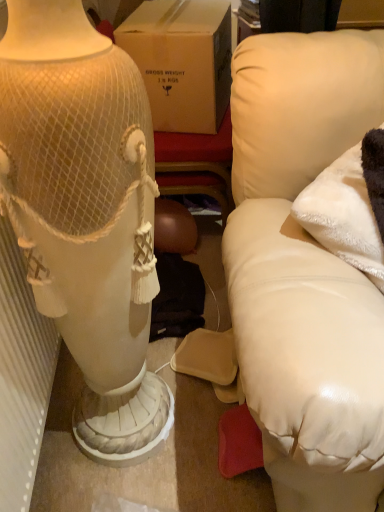
Find the location of a particular element. Image resolution: width=384 pixels, height=512 pixels. white fluffy pillow at right is located at coordinates (350, 207).

From a real-world perspective, is white fluffy pillow at right located beneath white textured radiator at left?

Actually, white fluffy pillow at right is physically above white textured radiator at left in the real world.

Considering the relative sizes of white fluffy pillow at right and white textured radiator at left in the image provided, is white fluffy pillow at right taller than white textured radiator at left?

Incorrect, the height of white fluffy pillow at right is not larger of that of white textured radiator at left.

Is white textured radiator at left surrounded by white fluffy pillow at right?

No, white textured radiator at left is not inside white fluffy pillow at right.

Which is more to the right, white textured radiator at left or white fluffy pillow at right?

white fluffy pillow at right.

From the picture: How different are the orientations of white textured radiator at left and white fluffy pillow at right in degrees?

The angular difference between white textured radiator at left and white fluffy pillow at right is 44.2 degrees.

Is white textured radiator at left positioned with its back to white fluffy pillow at right?

No, white textured radiator at left is not facing the opposite direction of white fluffy pillow at right.

Is white textured radiator at left not inside white fluffy pillow at right?

white textured radiator at left lies outside white fluffy pillow at right's area.

Visually, is white leather couch at right positioned to the left or to the right of white textured radiator at left?

In the image, white leather couch at right appears on the right side of white textured radiator at left.

From the image's perspective, which is above, white leather couch at right or white textured radiator at left?

white leather couch at right is shown above in the image.

Looking at this image, does white leather couch at right have a lesser width compared to white textured radiator at left?

No, white leather couch at right is not thinner than white textured radiator at left.

Based on the photo, is white leather couch at right facing away from white fluffy pillow at right?

Yes, white leather couch at right's orientation is away from white fluffy pillow at right.

Considering the relative sizes of white leather couch at right and white fluffy pillow at right in the image provided, is white leather couch at right wider than white fluffy pillow at right?

Yes, white leather couch at right is wider than white fluffy pillow at right.

Can you tell me how much white leather couch at right and white fluffy pillow at right differ in facing direction?

The angle between the facing direction of white leather couch at right and the facing direction of white fluffy pillow at right is 46.4 degrees.

From the image's perspective, which is above, white leather couch at right or white fluffy pillow at right?

white fluffy pillow at right appears higher in the image.

Which of these two, white fluffy pillow at right or white leather couch at right, is wider?

white leather couch at right.

Can you tell me how much white fluffy pillow at right and white leather couch at right differ in facing direction?

The facing directions of white fluffy pillow at right and white leather couch at right are 46.4 degrees apart.

Does white fluffy pillow at right have a lesser height compared to white leather couch at right?

Yes.

From a real-world perspective, relative to white leather couch at right, is white fluffy pillow at right vertically above or below?

white fluffy pillow at right is above white leather couch at right.

From a real-world perspective, is white textured radiator at left physically located above or below white leather couch at right?

In terms of real-world spatial position, white textured radiator at left is below white leather couch at right.

Is white textured radiator at left looking in the opposite direction of white leather couch at right?

No, white leather couch at right is not at the back of white textured radiator at left.

Considering the sizes of objects white textured radiator at left and white leather couch at right in the image provided, who is shorter, white textured radiator at left or white leather couch at right?

With less height is white textured radiator at left.

This screenshot has height=512, width=384. I want to click on radiator on the left of white fluffy pillow at right, so click(x=21, y=376).

I want to click on radiator below the white fluffy pillow at right (from a real-world perspective), so click(21, 376).

Based on their spatial positions, is white textured radiator at left or white leather couch at right further from white fluffy pillow at right?

white textured radiator at left lies further to white fluffy pillow at right than the other object.

Consider the image. Estimate the real-world distances between objects in this image. Which object is closer to white fluffy pillow at right, white leather couch at right or white textured radiator at left?

white leather couch at right.

Based on their spatial positions, is white leather couch at right or white fluffy pillow at right further from white textured radiator at left?

white fluffy pillow at right is positioned further to the anchor white textured radiator at left.

Based on their spatial positions, is white fluffy pillow at right or white leather couch at right further from white textured radiator at left?

The object further to white textured radiator at left is white fluffy pillow at right.

From the image, which object appears to be farther from white leather couch at right, white textured radiator at left or white fluffy pillow at right?

white textured radiator at left lies further to white leather couch at right than the other object.

Which object lies further to the anchor point white leather couch at right, white fluffy pillow at right or white textured radiator at left?

white textured radiator at left lies further to white leather couch at right than the other object.

Where is `furniture between white textured radiator at left and white fluffy pillow at right from left to right`? Image resolution: width=384 pixels, height=512 pixels. furniture between white textured radiator at left and white fluffy pillow at right from left to right is located at coordinates (305, 269).